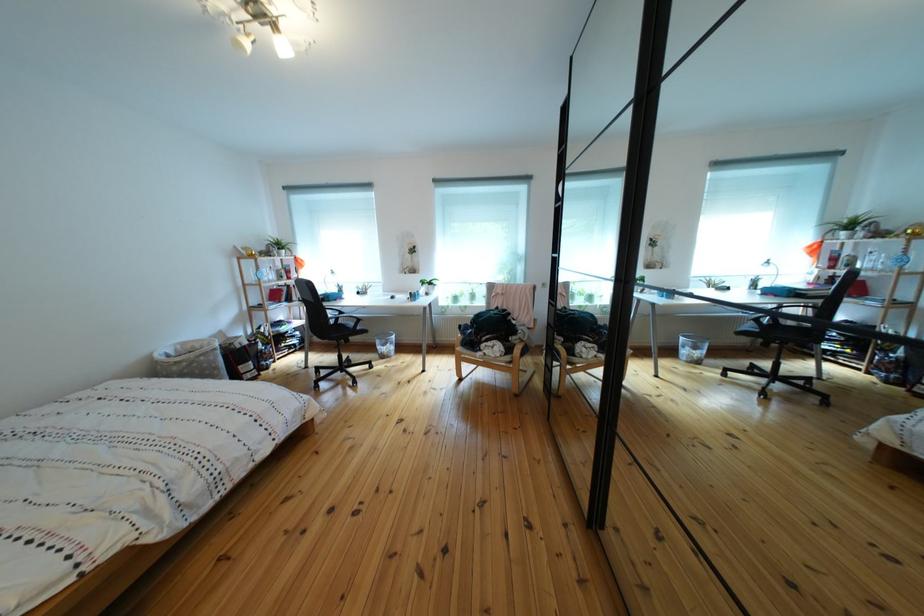
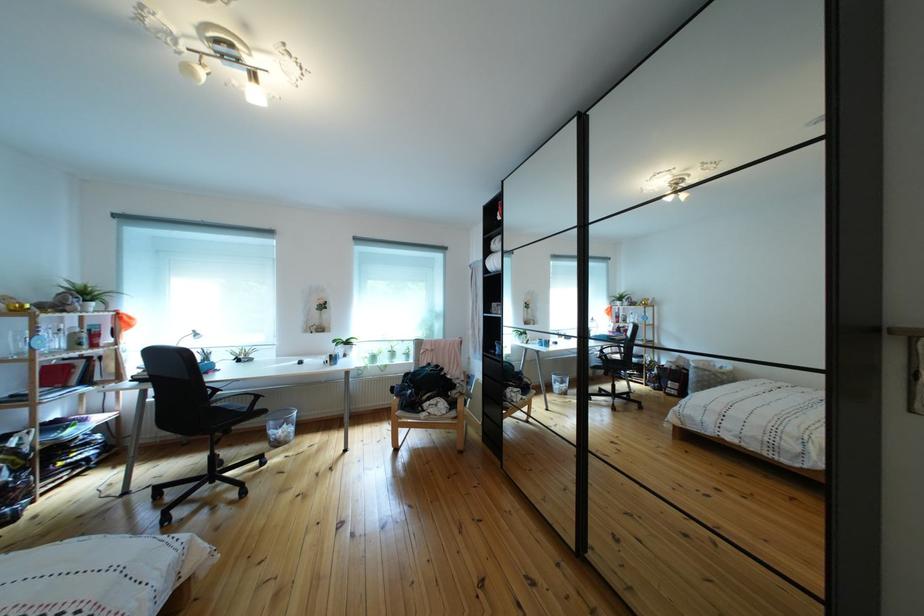
The point at (388, 347) is marked in the first image. Where is the corresponding point in the second image?

(283, 430)